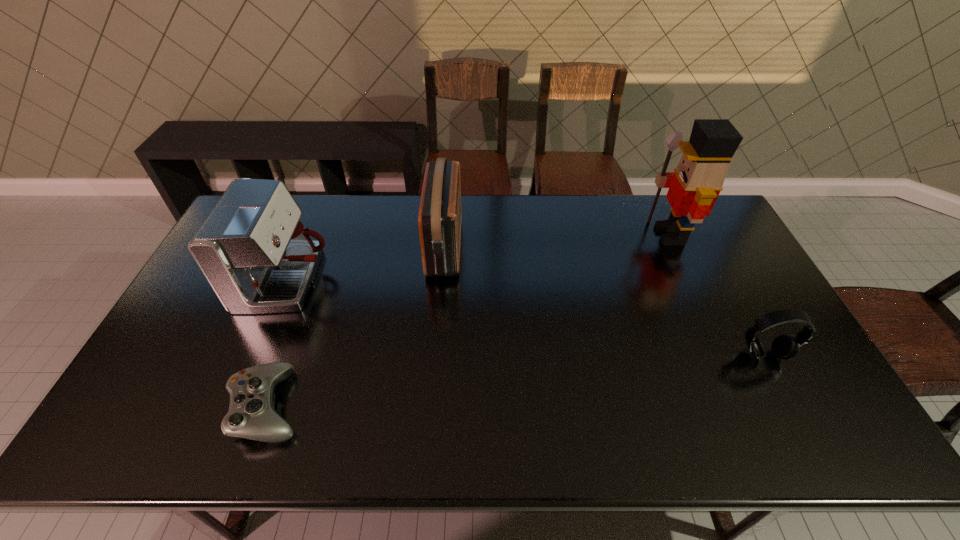
I want to click on nutcracker, so click(694, 187).

Where is `the third object from left to right`? the third object from left to right is located at coordinates (439, 220).

Find the location of a particular element. coffee maker is located at coordinates (257, 256).

At what (x,y) coordinates should I click in order to perform the action: click on the second shortest object. Please return your answer as a coordinate pair (x, y). This screenshot has width=960, height=540. Looking at the image, I should click on tap(785, 347).

Find the location of a particular element. earphone is located at coordinates (785, 347).

This screenshot has height=540, width=960. Find the location of `the nearest object`. the nearest object is located at coordinates (251, 415).

You are a GUI agent. You are given a task and a screenshot of the screen. Output one action in this format:
    pyautogui.click(x=<x>, y=<y>)
    Task: Click on the shortest object
    The width and height of the screenshot is (960, 540).
    Given the screenshot: What is the action you would take?
    pyautogui.click(x=251, y=415)

Where is `blank space located in front of the nutcracker holding the staff`? The height and width of the screenshot is (540, 960). blank space located in front of the nutcracker holding the staff is located at coordinates (548, 235).

The image size is (960, 540). What are the coordinates of `free space located 0.080m in front of the nutcracker holding the staff` in the screenshot? It's located at point(623,235).

This screenshot has height=540, width=960. I want to click on free space located 0.220m in front of the nutcracker holding the staff, so click(x=583, y=235).